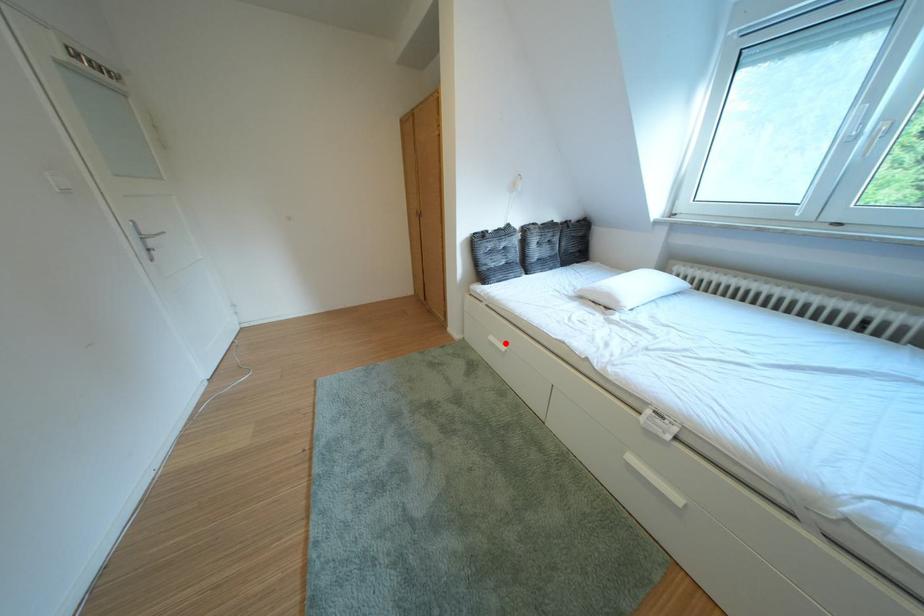
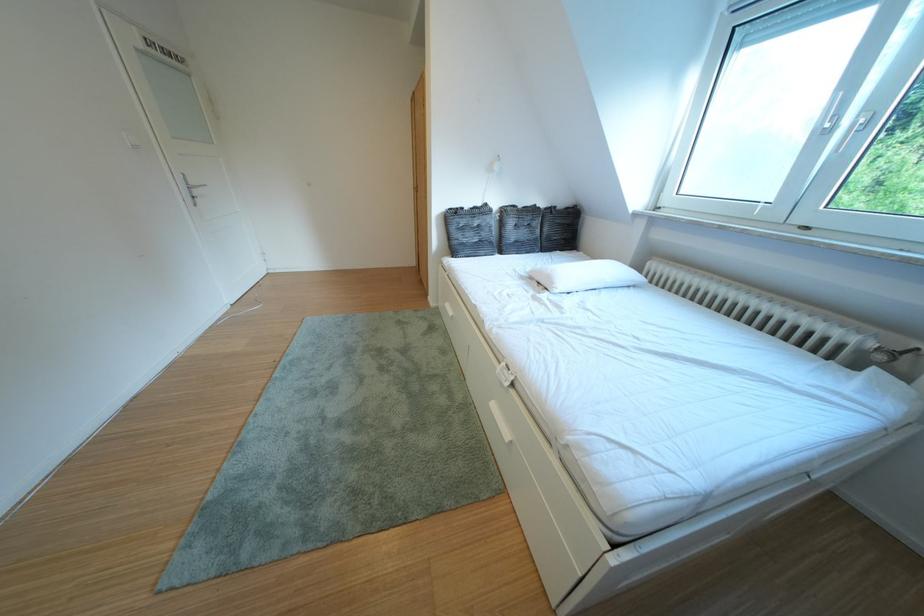
In the second image, find the point that corresponds to the highlighted location in the first image.

(460, 310)